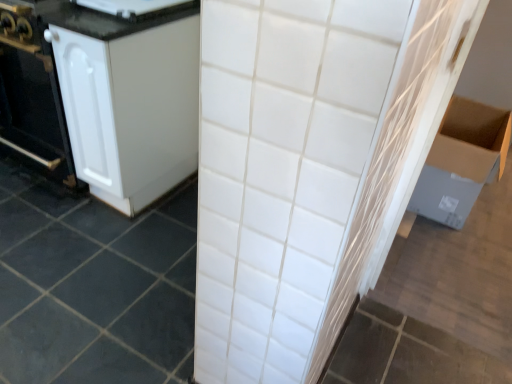
Question: Is cardboard box at right at the back of white glossy refrigerator at upper left?

Choices:
 (A) yes
 (B) no

Answer: (B)

Question: Considering the relative positions of white glossy refrigerator at upper left and cardboard box at right in the image provided, is white glossy refrigerator at upper left to the right of cardboard box at right from the viewer's perspective?

Choices:
 (A) no
 (B) yes

Answer: (A)

Question: Considering the relative sizes of white glossy refrigerator at upper left and cardboard box at right in the image provided, is white glossy refrigerator at upper left bigger than cardboard box at right?

Choices:
 (A) yes
 (B) no

Answer: (B)

Question: Can you confirm if white glossy refrigerator at upper left is thinner than cardboard box at right?

Choices:
 (A) yes
 (B) no

Answer: (B)

Question: Considering the relative sizes of white glossy refrigerator at upper left and cardboard box at right in the image provided, is white glossy refrigerator at upper left wider than cardboard box at right?

Choices:
 (A) no
 (B) yes

Answer: (B)

Question: Does white glossy refrigerator at upper left have a greater height compared to cardboard box at right?

Choices:
 (A) yes
 (B) no

Answer: (B)

Question: Considering the relative sizes of cardboard box at right and white ceramic tile at center in the image provided, is cardboard box at right wider than white ceramic tile at center?

Choices:
 (A) no
 (B) yes

Answer: (A)

Question: Is cardboard box at right bigger than white ceramic tile at center?

Choices:
 (A) yes
 (B) no

Answer: (B)

Question: Considering the relative sizes of cardboard box at right and white ceramic tile at center in the image provided, is cardboard box at right taller than white ceramic tile at center?

Choices:
 (A) yes
 (B) no

Answer: (A)

Question: Considering the relative sizes of cardboard box at right and white ceramic tile at center in the image provided, is cardboard box at right thinner than white ceramic tile at center?

Choices:
 (A) yes
 (B) no

Answer: (A)

Question: Can you confirm if cardboard box at right is smaller than white ceramic tile at center?

Choices:
 (A) no
 (B) yes

Answer: (B)

Question: Is cardboard box at right in front of white ceramic tile at center?

Choices:
 (A) yes
 (B) no

Answer: (B)

Question: From a real-world perspective, is white matte cabinet at left over white ceramic tile at center?

Choices:
 (A) yes
 (B) no

Answer: (A)